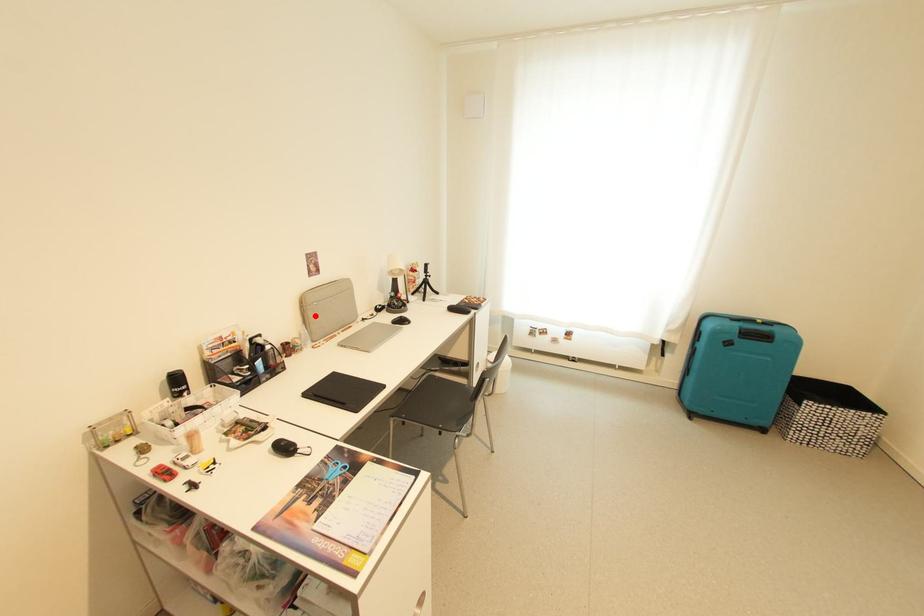
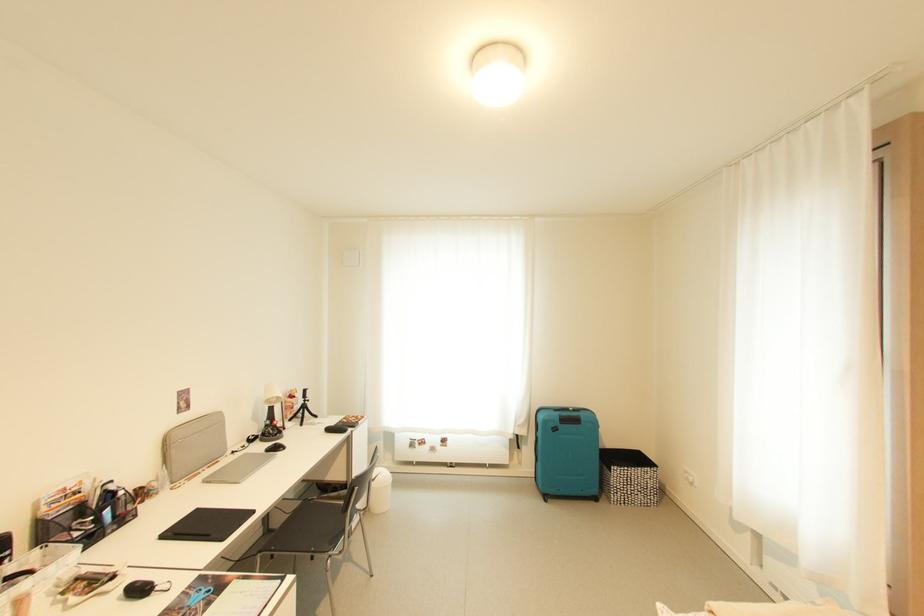
Find the pixel in the second image that matches the highlighted location in the first image.

(177, 455)